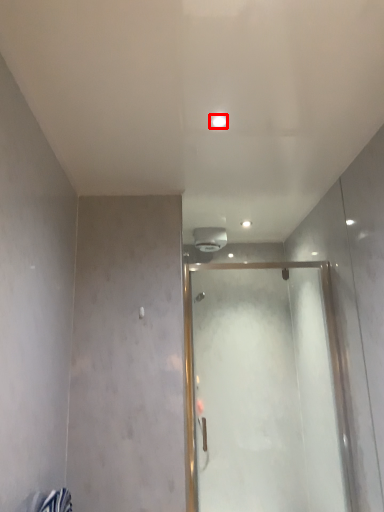
Question: Observing the image, what is the correct spatial positioning of light (annotated by the red box) in reference to glass door?

Choices:
 (A) right
 (B) left

Answer: (B)